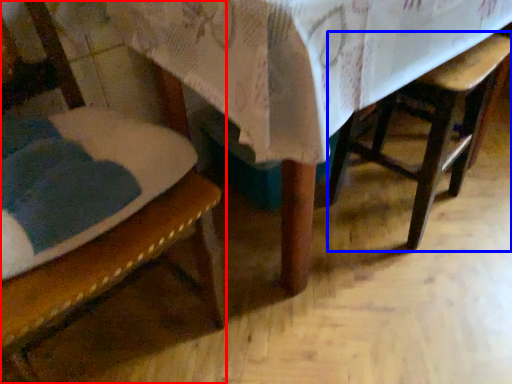
Question: Which point is closer to the camera, chair (highlighted by a red box) or armchair (highlighted by a blue box)?

Choices:
 (A) chair
 (B) armchair

Answer: (A)